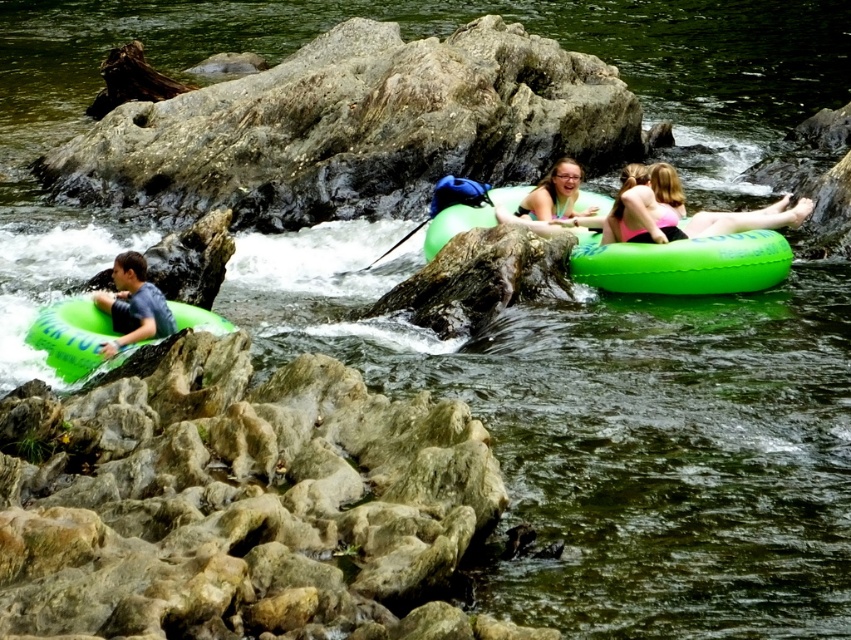
Question: Can you confirm if pink fabric bikini at upper right is positioned to the right of pink fabric bikini at center?

Choices:
 (A) no
 (B) yes

Answer: (B)

Question: In this image, where is matte green tube at left located relative to translucent green tube at center?

Choices:
 (A) above
 (B) below

Answer: (B)

Question: Which of the following is the farthest from the observer?

Choices:
 (A) green rubber tube at left
 (B) pink fabric bikini at center

Answer: (B)

Question: Which point is farther from the camera taking this photo?

Choices:
 (A) (621, 211)
 (B) (215, 326)
 (C) (130, 259)

Answer: (A)

Question: Which point appears farthest from the camera in this image?

Choices:
 (A) (646, 179)
 (B) (140, 269)
 (C) (452, 228)
 (D) (81, 312)

Answer: (A)

Question: Does pink fabric bikini at upper right appear on the left side of matte green tube at left?

Choices:
 (A) no
 (B) yes

Answer: (A)